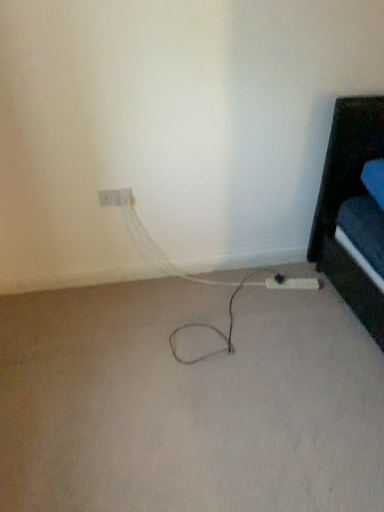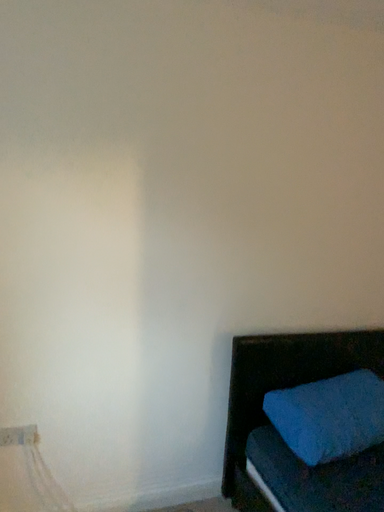
Question: Which way did the camera rotate in the video?

Choices:
 (A) rotated left
 (B) rotated right

Answer: (B)